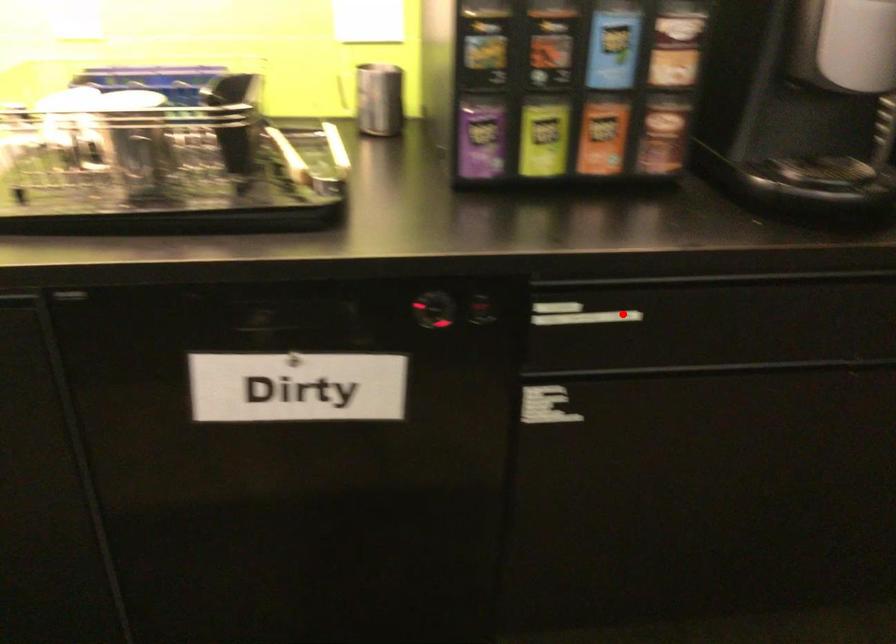
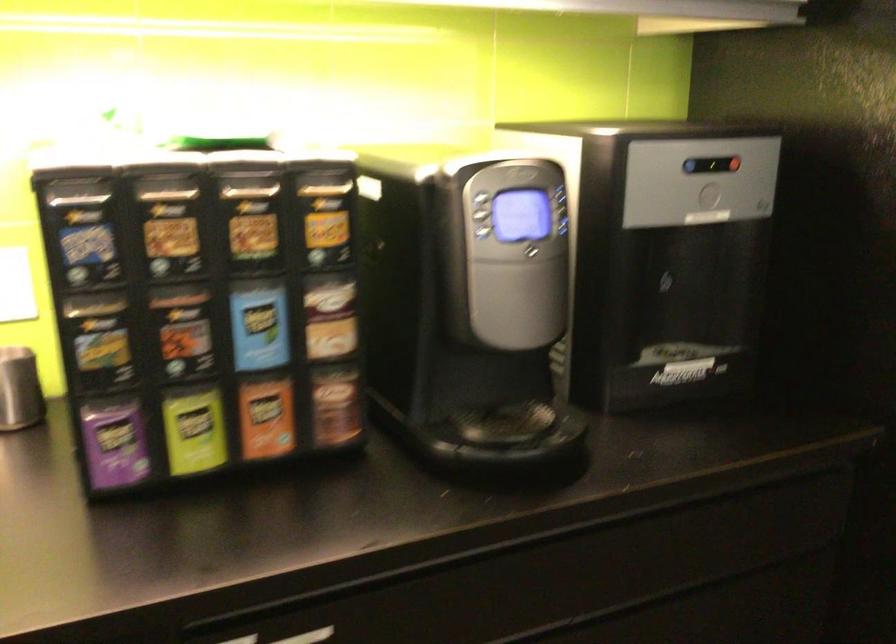
Question: A red point is marked in image1. In image2, is the corresponding 3D point closer to the camera or farther? Reply with the corresponding letter.

Choices:
 (A) The corresponding 3D point is closer.
 (B) The corresponding 3D point is farther.

Answer: (A)